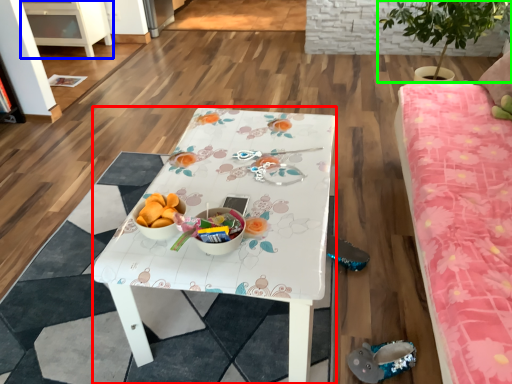
Question: Which object is positioned farthest from desk (highlighted by a red box)? Select from cabinetry (highlighted by a blue box) and houseplant (highlighted by a green box).

Choices:
 (A) cabinetry
 (B) houseplant

Answer: (A)